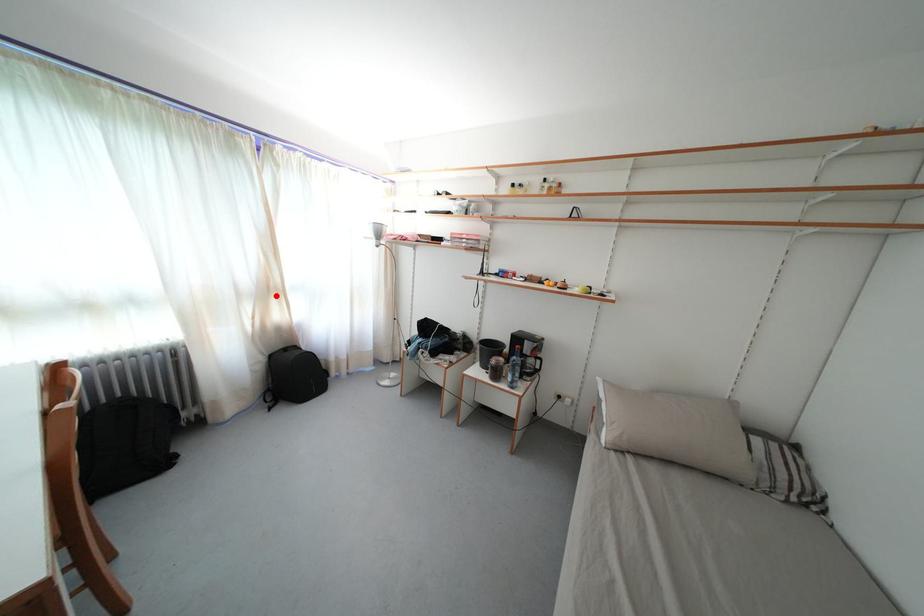
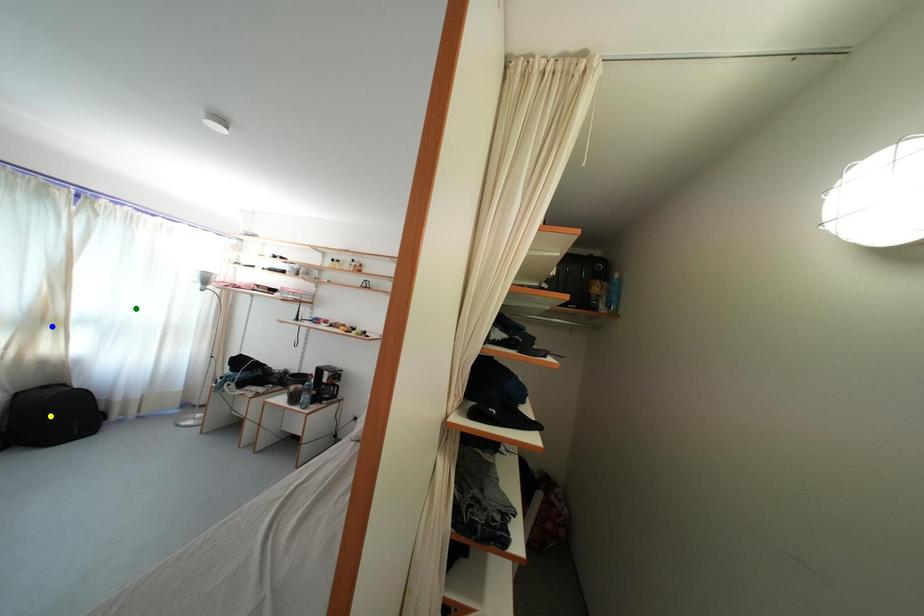
Question: I am providing you with two images of the same scene from different viewpoints. A red point is marked on the first image. You are given multiple points on the second image. In image 2, which mark is for the same physical point as the one in image 1?

Choices:
 (A) green point
 (B) yellow point
 (C) blue point

Answer: (C)